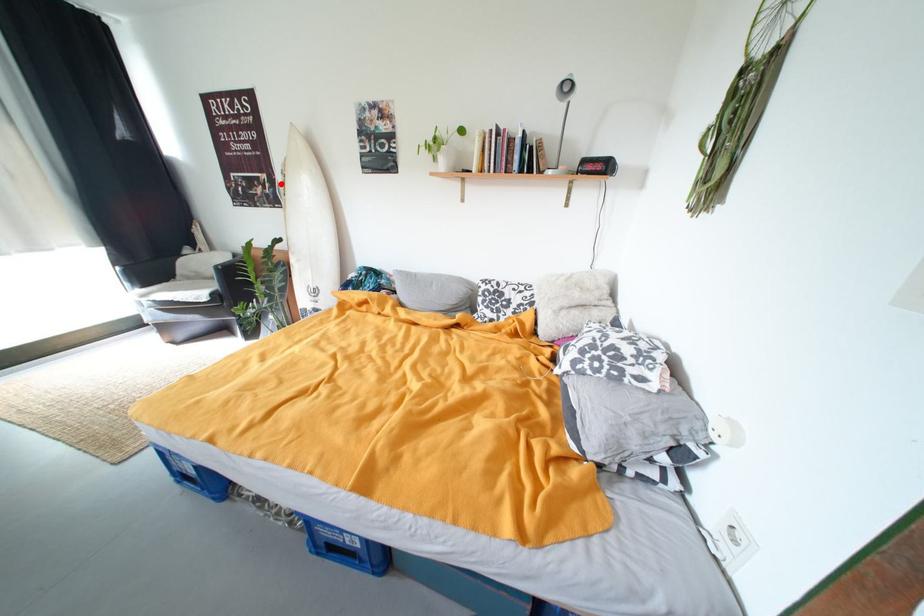
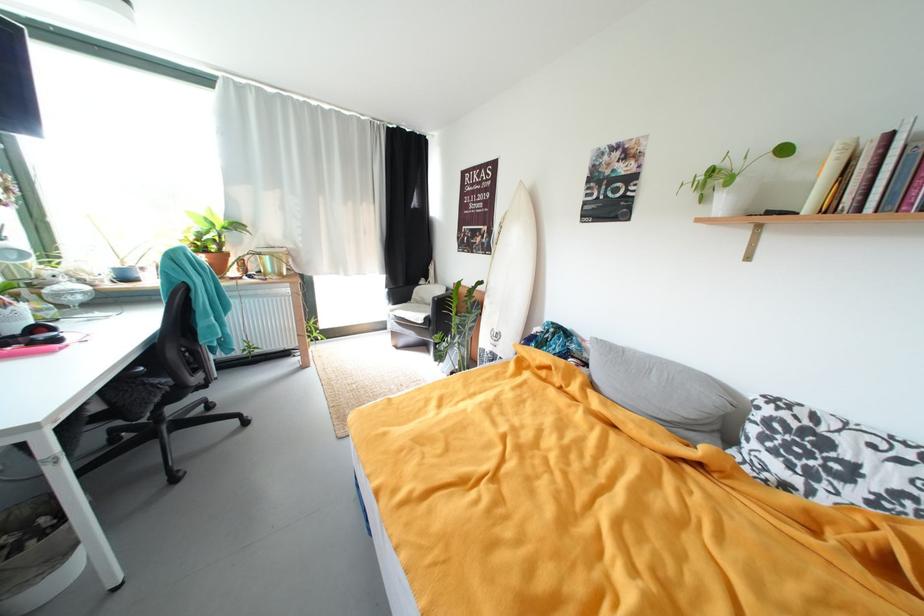
Where in the second image is the point corresponding to the highlighted location from the first image?

(497, 235)